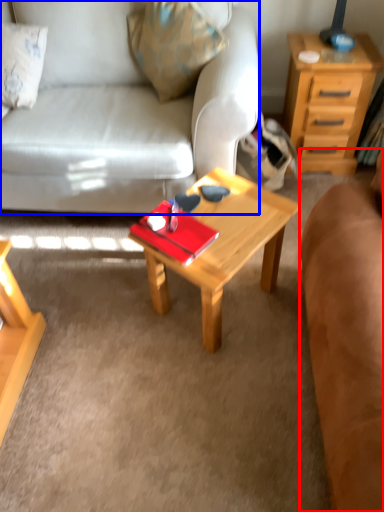
Question: Which object is closer to the camera taking this photo, studio couch (highlighted by a red box) or studio couch (highlighted by a blue box)?

Choices:
 (A) studio couch
 (B) studio couch

Answer: (A)